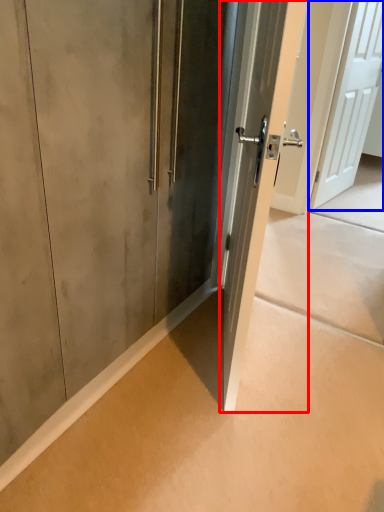
Question: Among these objects, which one is nearest to the camera, door (highlighted by a red box) or door (highlighted by a blue box)?

Choices:
 (A) door
 (B) door

Answer: (A)